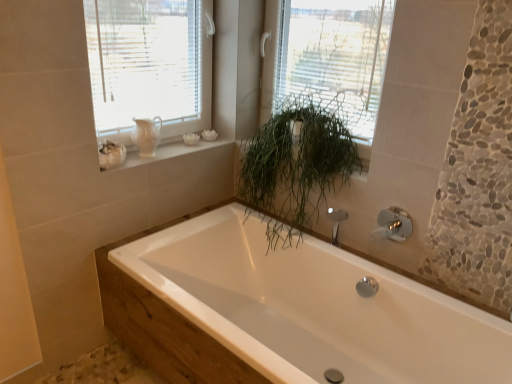
Question: From the image's perspective, is green leafy plant at upper center located beneath white glossy bathtub at center?

Choices:
 (A) yes
 (B) no

Answer: (B)

Question: Can you confirm if green leafy plant at upper center is bigger than white glossy bathtub at center?

Choices:
 (A) no
 (B) yes

Answer: (A)

Question: Is green leafy plant at upper center oriented towards white glossy bathtub at center?

Choices:
 (A) no
 (B) yes

Answer: (A)

Question: Is green leafy plant at upper center at the left side of white glossy bathtub at center?

Choices:
 (A) yes
 (B) no

Answer: (B)

Question: From a real-world perspective, is green leafy plant at upper center located beneath white glossy bathtub at center?

Choices:
 (A) yes
 (B) no

Answer: (B)

Question: Is white ceramic vase at upper left bigger or smaller than chrome metallic faucet at upper right?

Choices:
 (A) big
 (B) small

Answer: (A)

Question: From a real-world perspective, is white ceramic vase at upper left positioned above or below chrome metallic faucet at upper right?

Choices:
 (A) above
 (B) below

Answer: (A)

Question: From the image's perspective, is white ceramic vase at upper left above or below chrome metallic faucet at upper right?

Choices:
 (A) below
 (B) above

Answer: (B)

Question: Looking at their shapes, would you say white ceramic vase at upper left is wider or thinner than chrome metallic faucet at upper right?

Choices:
 (A) wide
 (B) thin

Answer: (A)

Question: In terms of size, does matte white pitcher at upper left appear bigger or smaller than green leafy plant at upper center?

Choices:
 (A) big
 (B) small

Answer: (B)

Question: In the image, is matte white pitcher at upper left positioned in front of or behind green leafy plant at upper center?

Choices:
 (A) behind
 (B) front

Answer: (A)

Question: Is point (147, 150) closer or farther from the camera than point (375, 23)?

Choices:
 (A) closer
 (B) farther

Answer: (B)

Question: Considering the positions of matte white pitcher at upper left and green leafy plant at upper center in the image, is matte white pitcher at upper left taller or shorter than green leafy plant at upper center?

Choices:
 (A) short
 (B) tall

Answer: (A)

Question: Is matte white pitcher at upper left wider or thinner than chrome metallic faucet at upper right?

Choices:
 (A) wide
 (B) thin

Answer: (A)

Question: From the image's perspective, is matte white pitcher at upper left positioned above or below chrome metallic faucet at upper right?

Choices:
 (A) above
 (B) below

Answer: (A)